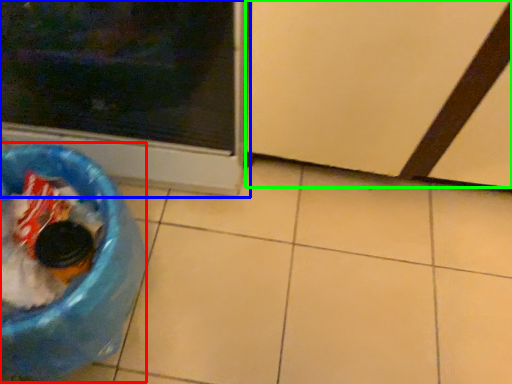
Question: Estimate the real-world distances between objects in this image. Which object is farther from recycling bin (highlighted by a red box), home appliance (highlighted by a blue box) or screen door (highlighted by a green box)?

Choices:
 (A) home appliance
 (B) screen door

Answer: (B)